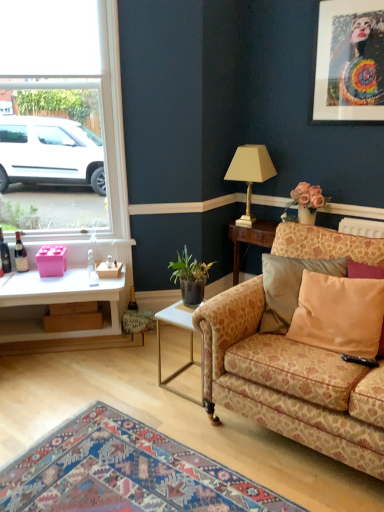
Question: Considering the positions of green leafy plant in pot at center and brown cardboard box at lower left, placed as the 2th box when sorted from top to bottom, in the image, is green leafy plant in pot at center taller or shorter than brown cardboard box at lower left, placed as the 2th box when sorted from top to bottom,?

Choices:
 (A) tall
 (B) short

Answer: (A)

Question: Is green leafy plant in pot at center to the left or to the right of brown cardboard box at lower left, placed as the 2th box when sorted from top to bottom, in the image?

Choices:
 (A) left
 (B) right

Answer: (B)

Question: Considering the real-world distances, which object is closest to the beige fabric pillow at right?

Choices:
 (A) green leafy plant in pot at center
 (B) brown cardboard box at lower left, placed as the 2th box when sorted from top to bottom
 (C) pink matte plastic box at left, the second box in the bottom-to-top sequence
 (D) clear glass bottle at left, the 3th bottle when ordered from left to right
 (E) matte glass bottle at left, the second bottle from the left

Answer: (A)

Question: Which object is positioned farthest from the floral-patterned fabric couch at right?

Choices:
 (A) metallic silver picture frame at upper right
 (B) matte glass bottle at left, the 1th bottle when ordered from left to right
 (C) white metal side table at lower center
 (D) clear glass bottle at left, positioned as the first bottle in right-to-left order
 (E) green leafy plant in pot at center

Answer: (B)